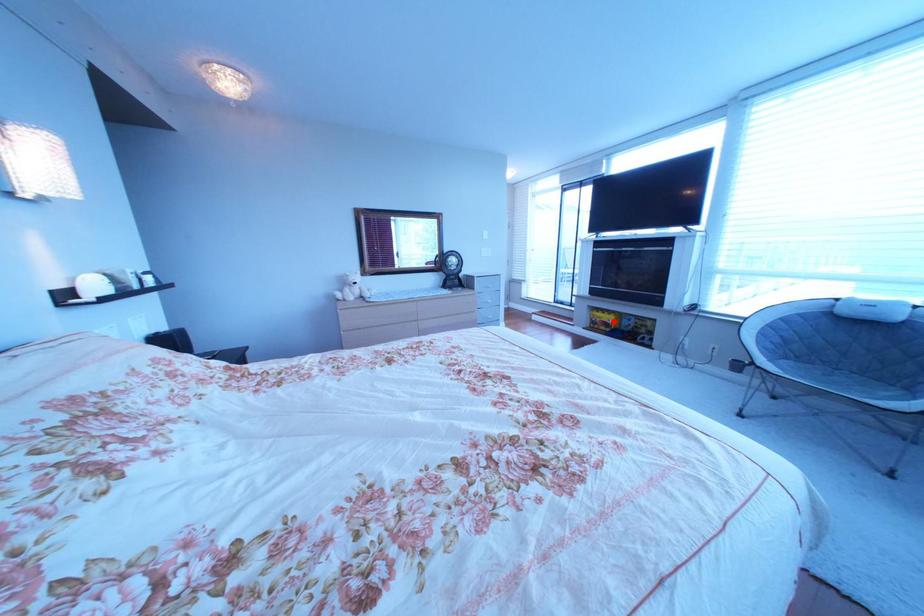
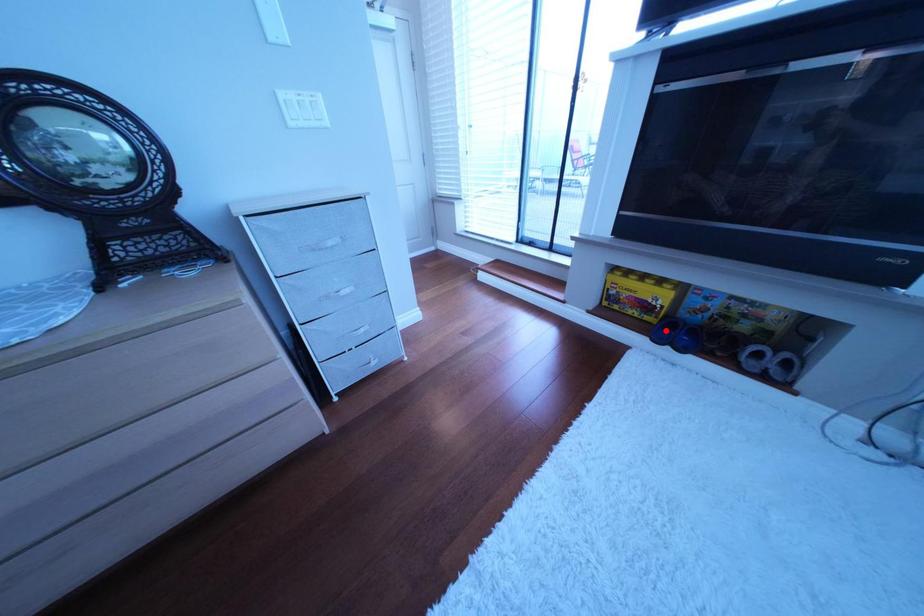
I am providing you with two images of the same scene from different viewpoints. A red point is marked on the first image and another point is marked on the second image. Does the point marked in image1 correspond to the same location as the one in image2?

No